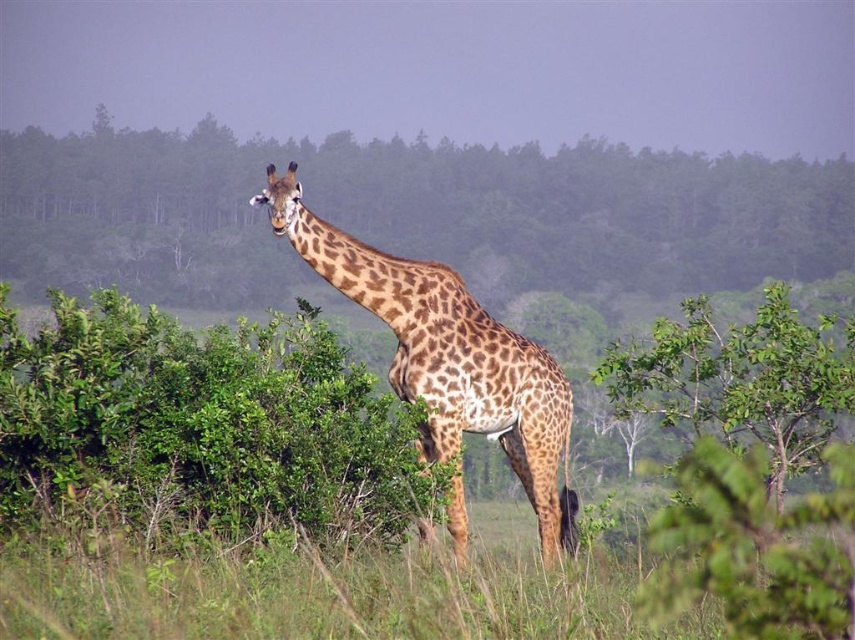
Based on the photo, you are a photographer trying to capture a clear photo of the spotted fur giraffe at center. The green leafy tree at center is blocking part of the giraffe. Which object should you move closer to in order to get a better shot?

The green leafy tree at center might be wider than the spotted fur giraffe at center, so moving closer to the spotted fur giraffe at center would help reduce the obstruction caused by the tree.

You are a photographer trying to capture the spotted fur giraffe at center in a clear shot. The green leafy bush at center is blocking part of the giraffe. Can you adjust your camera angle to avoid the bush?

The green leafy bush at center is smaller than the spotted fur giraffe at center. Since the bush is smaller, you can adjust your camera angle to position the camera either above or to the side of the bush to capture the giraffe clearly without obstruction.

You are a photographer who wants to capture the green leafy tree at center and the green leafy bush at center in the same frame. Based on their positions, which one would appear closer to the camera?

The green leafy bush at center appears closer to the camera because it is positioned below the green leafy tree at center, which is above it.